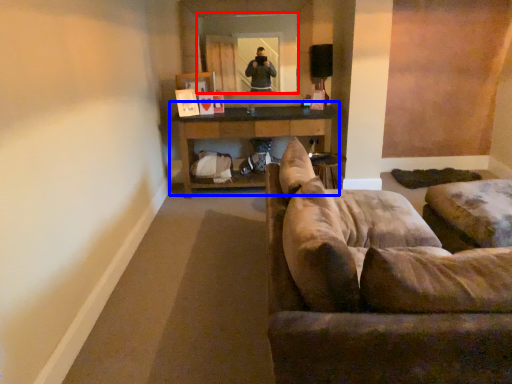
Question: Which of the following is the farthest to the observer, mirror (highlighted by a red box) or table (highlighted by a blue box)?

Choices:
 (A) mirror
 (B) table

Answer: (A)